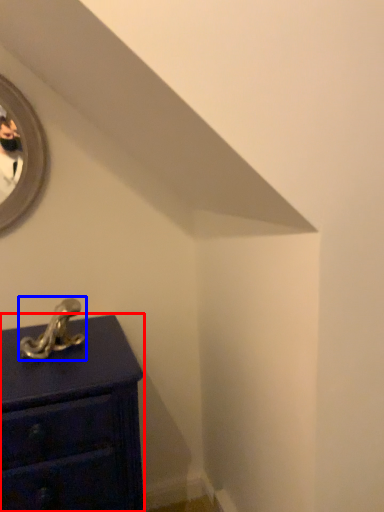
Question: Which object is further to the camera taking this photo, chest of drawers (highlighted by a red box) or antique (highlighted by a blue box)?

Choices:
 (A) chest of drawers
 (B) antique

Answer: (B)